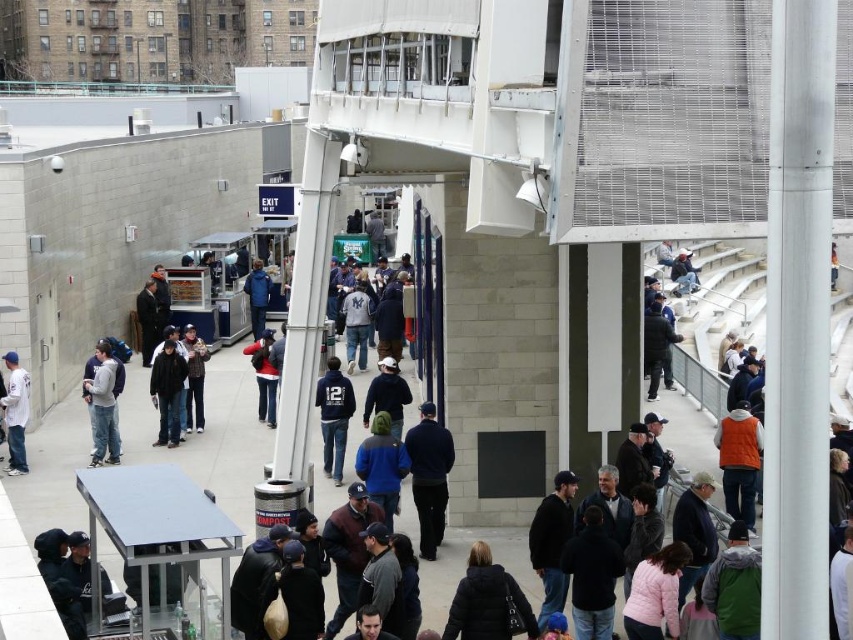
Question: Among these points, which one is nearest to the camera?

Choices:
 (A) (457, 616)
 (B) (100, 352)

Answer: (A)

Question: Can you confirm if dark blue sweater at center is positioned below white cotton baseball cap at left?

Choices:
 (A) yes
 (B) no

Answer: (A)

Question: Observing the image, what is the correct spatial positioning of black puffer jacket at center in reference to matte red jacket at center?

Choices:
 (A) above
 (B) below

Answer: (B)

Question: Is dark blue sweater at center behind dark blue jersey at center?

Choices:
 (A) yes
 (B) no

Answer: (B)

Question: Which of the following is the closest to the observer?

Choices:
 (A) (93, 449)
 (B) (7, 422)

Answer: (B)

Question: Which of the following is the farthest from the observer?

Choices:
 (A) matte red jacket at center
 (B) dark blue jacket at center
 (C) dark blue sweater at center
 (D) orange fleece jacket at right

Answer: (A)